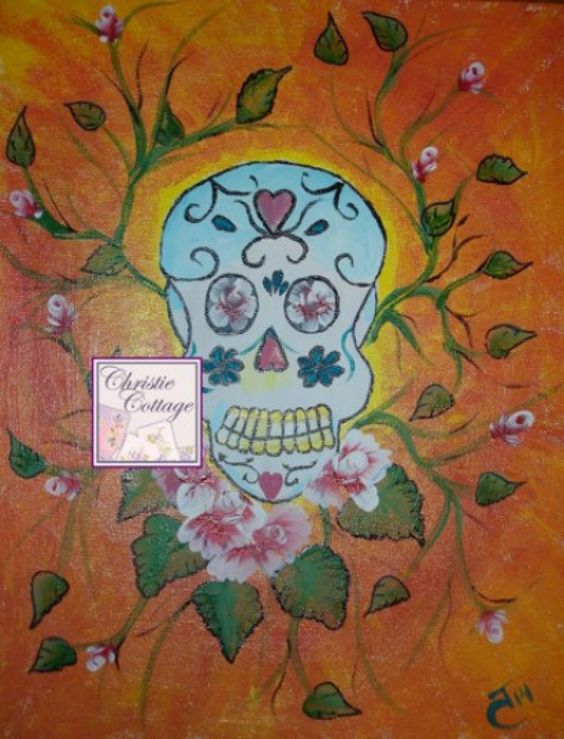
This screenshot has width=564, height=739. I want to click on sticker, so click(161, 398).